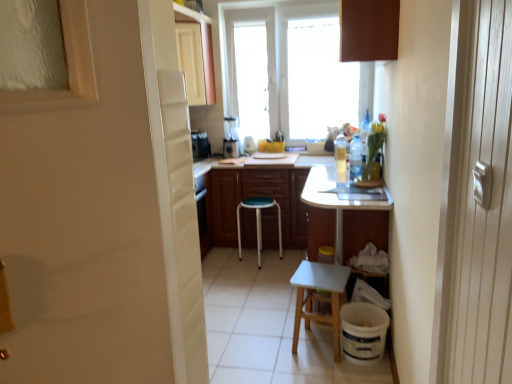
Question: Is green plastic stool at center, placed as the first stool when sorted from back to front, at the back of metallic silver blender at center?

Choices:
 (A) yes
 (B) no

Answer: (B)

Question: Is green plastic stool at center, the 2th stool from the front, completely or partially inside metallic silver blender at center?

Choices:
 (A) yes
 (B) no

Answer: (B)

Question: Is metallic silver blender at center smaller than green plastic stool at center, placed as the first stool when sorted from left to right?

Choices:
 (A) yes
 (B) no

Answer: (A)

Question: Does metallic silver blender at center have a greater height compared to green plastic stool at center, the 2th stool in the right-to-left sequence?

Choices:
 (A) no
 (B) yes

Answer: (A)

Question: Is metallic silver blender at center far away from green plastic stool at center, the 2th stool from the front?

Choices:
 (A) yes
 (B) no

Answer: (B)

Question: Is green plastic stool at center, the 2th stool in the right-to-left sequence, situated inside brown matte cabinet at upper center, marked as the 3th cabinetry in a left-to-right arrangement, or outside?

Choices:
 (A) inside
 (B) outside

Answer: (B)

Question: From a real-world perspective, is green plastic stool at center, placed as the first stool when sorted from left to right, positioned above or below brown matte cabinet at upper center, marked as the 3th cabinetry in a left-to-right arrangement?

Choices:
 (A) below
 (B) above

Answer: (A)

Question: Would you say green plastic stool at center, placed as the first stool when sorted from back to front, is to the left or to the right of brown matte cabinet at upper center, placed as the 1th cabinetry when sorted from front to back, in the picture?

Choices:
 (A) left
 (B) right

Answer: (A)

Question: Considering the positions of point (279, 253) and point (357, 21), is point (279, 253) closer or farther from the camera than point (357, 21)?

Choices:
 (A) farther
 (B) closer

Answer: (A)

Question: In the image, is green plastic stool at center, placed as the first stool when sorted from left to right, on the left side or the right side of metallic silver blender at center?

Choices:
 (A) right
 (B) left

Answer: (A)

Question: From a real-world perspective, is green plastic stool at center, the 2th stool from the front, positioned above or below metallic silver blender at center?

Choices:
 (A) below
 (B) above

Answer: (A)

Question: In terms of width, does green plastic stool at center, the 2th stool in the right-to-left sequence, look wider or thinner when compared to metallic silver blender at center?

Choices:
 (A) wide
 (B) thin

Answer: (A)

Question: Considering the positions of point (262, 200) and point (226, 140), is point (262, 200) closer or farther from the camera than point (226, 140)?

Choices:
 (A) farther
 (B) closer

Answer: (B)

Question: Considering their positions, is clear plastic bottle at right, the 3th bottle viewed from the back, located in front of or behind white glossy screen door at left?

Choices:
 (A) behind
 (B) front

Answer: (A)

Question: Considering the positions of clear plastic bottle at right, the second bottle positioned from the left, and white glossy screen door at left in the image, is clear plastic bottle at right, the second bottle positioned from the left, wider or thinner than white glossy screen door at left?

Choices:
 (A) thin
 (B) wide

Answer: (B)